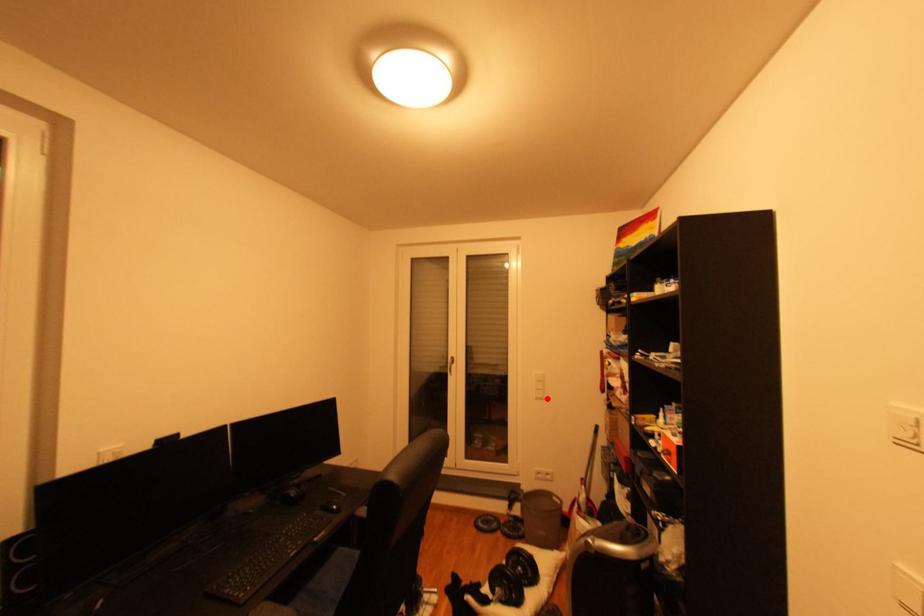
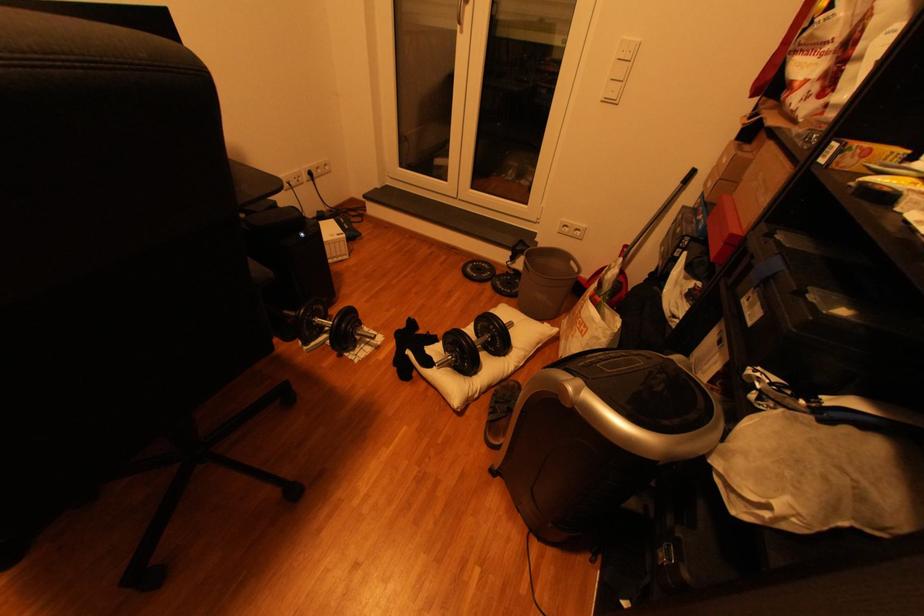
Question: I am providing you with two images of the same scene from different viewpoints. Image1 has a red point marked. In image2, the corresponding 3D location appears at what relative position? Reply with the corresponding letter.

Choices:
 (A) Closer
 (B) Farther

Answer: (A)